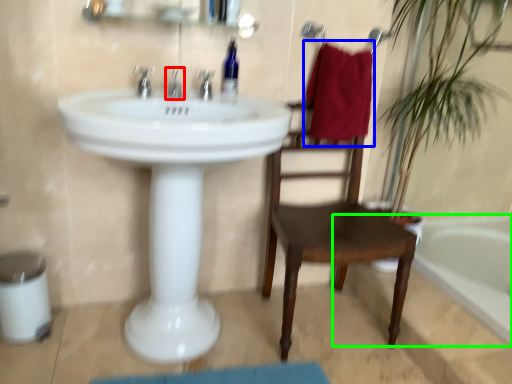
Question: Which object is the closest to the tap (highlighted by a red box)? Choose among these: beach towel (highlighted by a blue box) or bathtub (highlighted by a green box).

Choices:
 (A) beach towel
 (B) bathtub

Answer: (A)